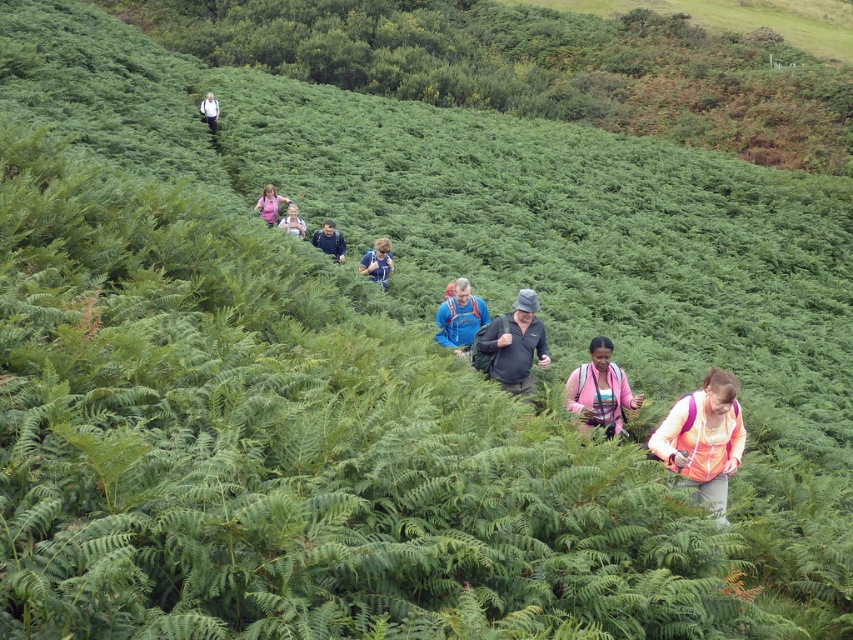
You are a hiker who just arrived at the trailhead and see the orange fabric backpack at lower right. The nearest hiker to you is 8.12 meters away. Can you hear their conversation if you shout?

The nearest hiker to you is 8.12 meters away. Shouting can typically be heard up to 10 meters away, so yes, you can hear their conversation if you shout.

You are a hiker who wants to ensure your belongings are secure. You notice an orange fabric backpack at lower right and a pink fabric jacket at center. Which item has a larger capacity for storing items?

The orange fabric backpack at lower right is bigger than the pink fabric jacket at center, so it has a larger capacity for storing items.